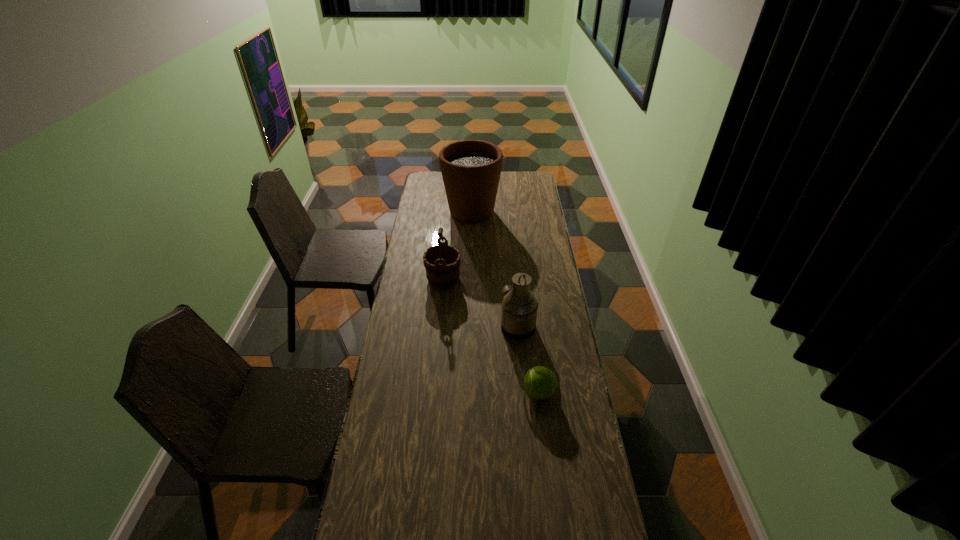
What are the coordinates of `the farthest object` in the screenshot? It's located at (471, 169).

Locate an element on the screen. the tallest object is located at coordinates (471, 169).

You are a GUI agent. You are given a task and a screenshot of the screen. Output one action in this format:
    pyautogui.click(x=<x>, y=<y>)
    Task: Click on the pitcher
    The image size is (960, 540).
    Given the screenshot: What is the action you would take?
    pyautogui.click(x=519, y=306)

This screenshot has width=960, height=540. What are the coordinates of `the third nearest object` in the screenshot? It's located at (442, 262).

Where is `the shortest object`? The width and height of the screenshot is (960, 540). the shortest object is located at coordinates (540, 383).

What are the coordinates of `tennis ball` in the screenshot? It's located at (540, 383).

This screenshot has height=540, width=960. What are the coordinates of `blank area located on the left of the tallest object` in the screenshot? It's located at (434, 212).

At what (x,y) coordinates should I click in order to perform the action: click on vacant space located on the right of the second nearest object. Please return your answer as a coordinate pair (x, y). This screenshot has width=960, height=540. Looking at the image, I should click on (569, 327).

The width and height of the screenshot is (960, 540). Find the location of `vacant space located 0.130m on the front of the wine bucket`. vacant space located 0.130m on the front of the wine bucket is located at coordinates (441, 313).

The width and height of the screenshot is (960, 540). I want to click on free space located 0.100m on the right of the tennis ball, so click(x=583, y=393).